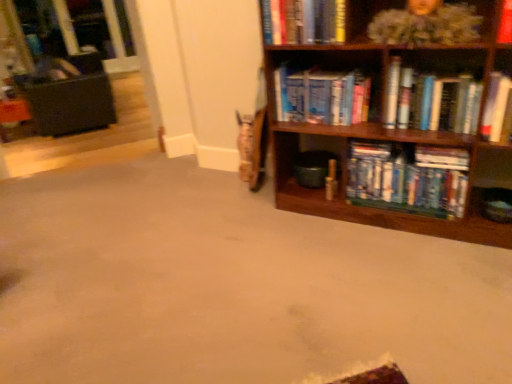
Find the location of a particular element. Image resolution: width=512 pixels, height=384 pixels. wooden bookcase at right is located at coordinates (399, 125).

The image size is (512, 384). I want to click on hardcover book at right, the 4th book when ordered from top to bottom, so click(495, 106).

Which of these two, hardcover book at upper right, the third book from the top, or hardcover book at right, the 4th book when ordered from top to bottom, is bigger?

hardcover book at upper right, the third book from the top, is bigger.

How different are the orientations of hardcover book at upper right, the third book ordered from the bottom, and hardcover book at right, the 4th book when ordered from top to bottom, in degrees?

They differ by 0.836 degrees in their facing directions.

Which is farther, (462, 84) or (499, 112)?

Positioned behind is point (499, 112).

Between point (463, 176) and point (442, 107), which one is positioned behind?

The point (463, 176) is farther from the camera.

Based on the photo, from a real-world perspective, which is physically below, hardcover books at center, which is the 1th book in bottom-to-top order, or hardcover book at upper right, the third book from the top?

hardcover books at center, which is the 1th book in bottom-to-top order, from a real-world perspective.

Between hardcover books at center, placed as the 5th book when sorted from top to bottom, and hardcover book at upper right, the third book from the top, which one has smaller width?

With smaller width is hardcover book at upper right, the third book from the top.

Is hardcover books at center, placed as the 5th book when sorted from top to bottom, directly adjacent to hardcover book at upper right, the third book ordered from the bottom?

There is a gap between hardcover books at center, placed as the 5th book when sorted from top to bottom, and hardcover book at upper right, the third book ordered from the bottom.

How many degrees apart are the facing directions of hardcover books at center, which is the 1th book in bottom-to-top order, and hardcover book at right, the second book ordered from the bottom?

They differ by 1.95 degrees in their facing directions.

Does hardcover books at center, which is the 1th book in bottom-to-top order, have a lesser height compared to hardcover book at right, the second book ordered from the bottom?

No, hardcover books at center, which is the 1th book in bottom-to-top order, is not shorter than hardcover book at right, the second book ordered from the bottom.

Could you measure the distance between hardcover books at center, which is the 1th book in bottom-to-top order, and hardcover book at right, the 4th book when ordered from top to bottom?

hardcover books at center, which is the 1th book in bottom-to-top order, is 12.95 inches away from hardcover book at right, the 4th book when ordered from top to bottom.

Considering the positions of point (374, 183) and point (486, 114), is point (374, 183) closer or farther from the camera than point (486, 114)?

Point (374, 183) is farther from the camera than point (486, 114).

Considering the relative sizes of black leather swivel chair at left and hardcover books at center, placed as the 5th book when sorted from top to bottom, in the image provided, is black leather swivel chair at left shorter than hardcover books at center, placed as the 5th book when sorted from top to bottom,?

No.

Does black leather swivel chair at left have a greater width compared to hardcover books at center, placed as the 5th book when sorted from top to bottom?

Yes, black leather swivel chair at left is wider than hardcover books at center, placed as the 5th book when sorted from top to bottom.

Is black leather swivel chair at left next to hardcover books at center, which is the 1th book in bottom-to-top order, and touching it?

black leather swivel chair at left and hardcover books at center, which is the 1th book in bottom-to-top order, are not in contact.

From the picture: Is black leather swivel chair at left positioned before hardcover books at center, which is the 1th book in bottom-to-top order?

No.

Considering the sizes of hardcover book at upper center, which ranks as the 1th book in top-to-bottom order, and wooden bookcase at right in the image, is hardcover book at upper center, which ranks as the 1th book in top-to-bottom order, bigger or smaller than wooden bookcase at right?

hardcover book at upper center, which ranks as the 1th book in top-to-bottom order, is smaller than wooden bookcase at right.

Could you tell me if hardcover book at upper center, which ranks as the 1th book in top-to-bottom order, is turned towards wooden bookcase at right?

Yes, hardcover book at upper center, which ranks as the 1th book in top-to-bottom order, is facing wooden bookcase at right.

What's the angular difference between hardcover book at upper center, arranged as the 5th book when ordered from the bottom, and wooden bookcase at right's facing directions?

The angle between the facing direction of hardcover book at upper center, arranged as the 5th book when ordered from the bottom, and the facing direction of wooden bookcase at right is 1.22 degrees.

Is black leather swivel chair at left not near hardcover book at upper right, the third book from the top?

Yes, black leather swivel chair at left is far from hardcover book at upper right, the third book from the top.

Considering the relative sizes of black leather swivel chair at left and hardcover book at upper right, the third book from the top, in the image provided, is black leather swivel chair at left thinner than hardcover book at upper right, the third book from the top,?

No, black leather swivel chair at left is not thinner than hardcover book at upper right, the third book from the top.

Which is behind, black leather swivel chair at left or hardcover book at upper right, the third book from the top?

black leather swivel chair at left is more distant.

Looking at the image, does black leather swivel chair at left seem bigger or smaller compared to hardcover book at upper right, the third book from the top?

In the image, black leather swivel chair at left appears to be larger than hardcover book at upper right, the third book from the top.

Considering their positions, is hardcover book at upper center, which ranks as the 1th book in top-to-bottom order, located in front of or behind hardcover book at upper right, the third book ordered from the bottom?

hardcover book at upper center, which ranks as the 1th book in top-to-bottom order, is positioned farther from the viewer than hardcover book at upper right, the third book ordered from the bottom.

Is hardcover book at upper center, arranged as the 5th book when ordered from the bottom, facing towards hardcover book at upper right, the third book ordered from the bottom?

No.

From the image's perspective, who appears lower, hardcover book at upper center, arranged as the 5th book when ordered from the bottom, or hardcover book at upper right, the third book from the top?

hardcover book at upper right, the third book from the top, is shown below in the image.

This screenshot has height=384, width=512. I want to click on book on the right side of hardcover book at upper right, the third book from the top, so click(x=495, y=106).

From the hardcover book at upper right, the third book ordered from the bottom, count 2nd books backward and point to it. Please provide its 2D coordinates.

[(408, 179)]

From the picture: From the image, which object appears to be nearer to hardcover books at center, which ranks as the 2th book in top-to-bottom order, wooden bookcase at right or hardcover book at upper right, the third book ordered from the bottom?

Based on the image, wooden bookcase at right appears to be nearer to hardcover books at center, which ranks as the 2th book in top-to-bottom order.

When comparing their distances from wooden bookcase at right, does black leather swivel chair at left or hardcover books at center, placed as the 5th book when sorted from top to bottom, seem closer?

hardcover books at center, placed as the 5th book when sorted from top to bottom, is positioned closer to the anchor wooden bookcase at right.

Considering their positions, is wooden bookcase at right positioned closer to hardcover book at upper right, the third book from the top, than black leather swivel chair at left?

wooden bookcase at right.

Looking at the image, which one is located further to hardcover book at upper center, which ranks as the 1th book in top-to-bottom order, hardcover books at center, placed as the 5th book when sorted from top to bottom, or hardcover book at right, the second book ordered from the bottom?

The object further to hardcover book at upper center, which ranks as the 1th book in top-to-bottom order, is hardcover book at right, the second book ordered from the bottom.

When comparing their distances from black leather swivel chair at left, does hardcover books at center, the 4th book when ordered from bottom to top, or hardcover books at center, placed as the 5th book when sorted from top to bottom, seem closer?

hardcover books at center, the 4th book when ordered from bottom to top.

Looking at the image, which one is located further to wooden bookcase at right, hardcover book at upper right, the third book ordered from the bottom, or hardcover books at center, placed as the 5th book when sorted from top to bottom?

hardcover book at upper right, the third book ordered from the bottom, lies further to wooden bookcase at right than the other object.

Consider the image. Considering their positions, is hardcover book at right, the second book ordered from the bottom, positioned further to black leather swivel chair at left than hardcover book at upper center, arranged as the 5th book when ordered from the bottom?

hardcover book at right, the second book ordered from the bottom, lies further to black leather swivel chair at left than the other object.

Looking at the image, which one is located closer to hardcover books at center, which ranks as the 2th book in top-to-bottom order, hardcover book at upper center, which ranks as the 1th book in top-to-bottom order, or hardcover books at center, which is the 1th book in bottom-to-top order?

The object closer to hardcover books at center, which ranks as the 2th book in top-to-bottom order, is hardcover book at upper center, which ranks as the 1th book in top-to-bottom order.

Locate an element on the screen. Image resolution: width=512 pixels, height=384 pixels. bookcase situated between hardcover books at center, which ranks as the 2th book in top-to-bottom order, and hardcover book at right, the 4th book when ordered from top to bottom, from left to right is located at coordinates (399, 125).

Image resolution: width=512 pixels, height=384 pixels. I want to click on book between hardcover book at upper right, the third book ordered from the bottom, and hardcover books at center, which is the 1th book in bottom-to-top order, in the vertical direction, so click(495, 106).

This screenshot has width=512, height=384. I want to click on book between hardcover books at center, which ranks as the 2th book in top-to-bottom order, and hardcover book at upper right, the third book ordered from the bottom, so (408, 179).

Find the location of a particular element. bookcase located between hardcover book at upper center, which ranks as the 1th book in top-to-bottom order, and hardcover book at upper right, the third book from the top, in the left-right direction is located at coordinates (399, 125).